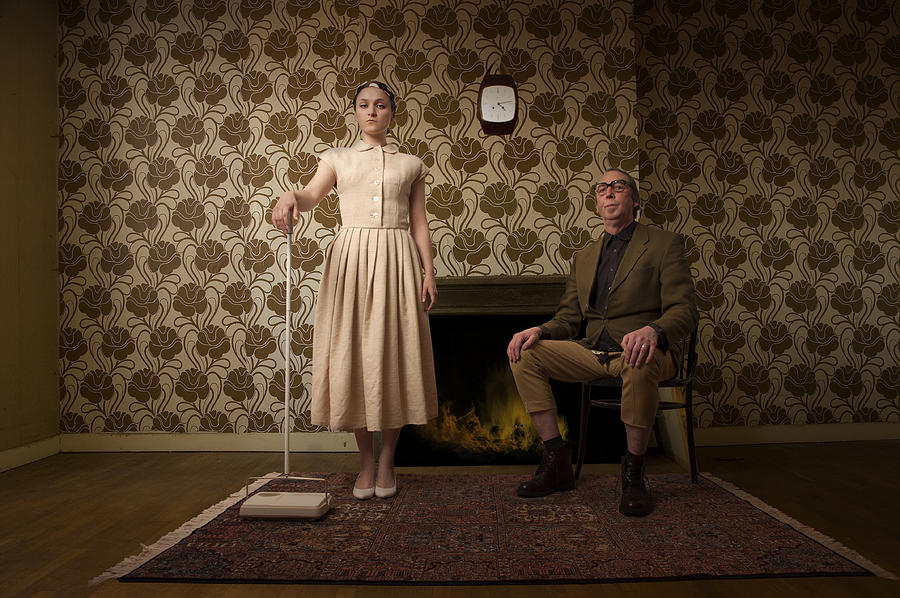
This screenshot has width=900, height=598. In order to click on wooden frame in this screenshot , I will do `click(472, 299)`.